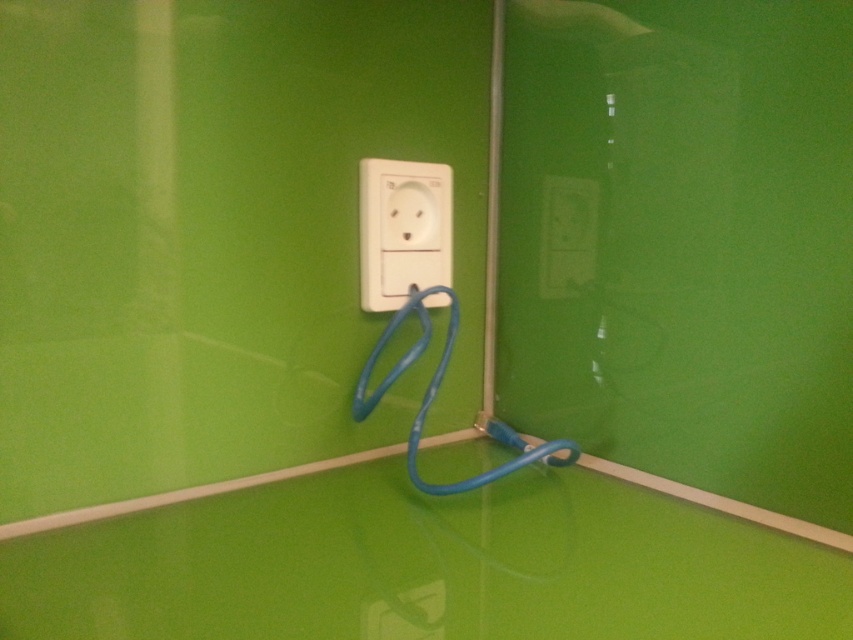
Is point (358, 209) positioned in front of point (573, 204)?

Yes, it is.

Who is more distant from viewer, (386, 234) or (553, 296)?

Positioned behind is point (553, 296).

This screenshot has height=640, width=853. In order to click on white plastic socket at center in this screenshot , I will do `click(402, 228)`.

Does white plastic socket at center have a greater width compared to white plastic outlet at lower center?

Correct, the width of white plastic socket at center exceeds that of white plastic outlet at lower center.

Is white plastic socket at center below white plastic outlet at lower center?

Incorrect, white plastic socket at center is not positioned below white plastic outlet at lower center.

Does point (437, 204) come farther from viewer compared to point (403, 611)?

Yes, point (437, 204) is behind point (403, 611).

At what (x,y) coordinates should I click in order to perform the action: click on white plastic socket at center. Please return your answer as a coordinate pair (x, y). Looking at the image, I should click on (402, 228).

Is white plastic outlet at upper center bigger than white plastic outlet at lower center?

Yes.

Is point (595, 193) closer to viewer compared to point (416, 632)?

No, it is not.

Locate an element on the screen. This screenshot has height=640, width=853. white plastic outlet at upper center is located at coordinates (567, 236).